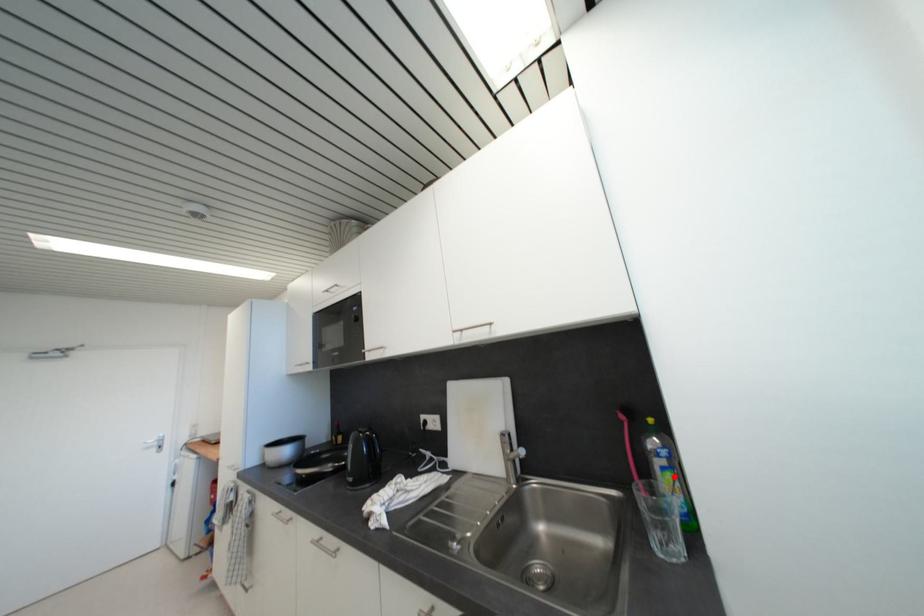
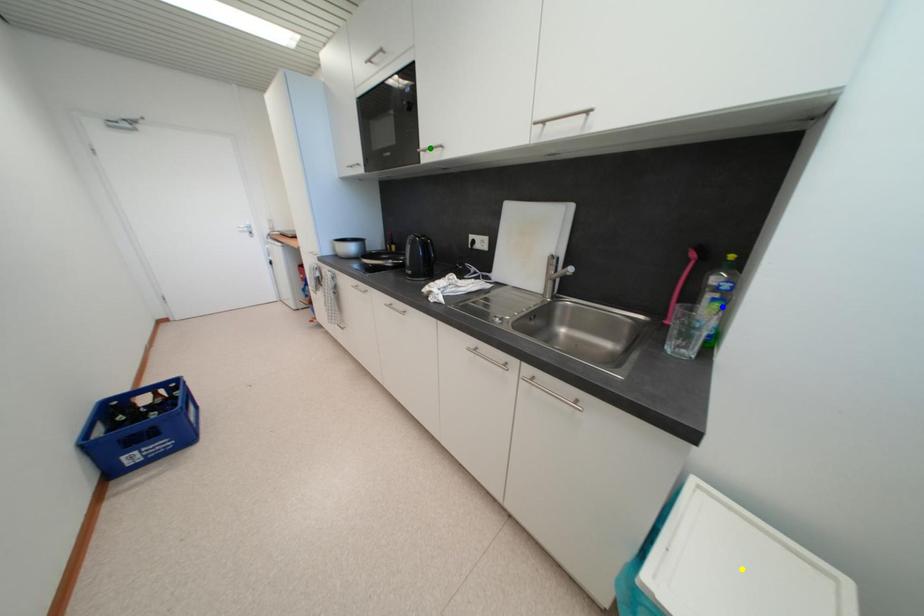
Question: I am providing you with two images of the same scene from different viewpoints. A red point is marked on the first image. You are given multiple points on the second image. Which spot in image 2 lines up with the point in image 1?

Choices:
 (A) blue point
 (B) green point
 (C) yellow point

Answer: (A)